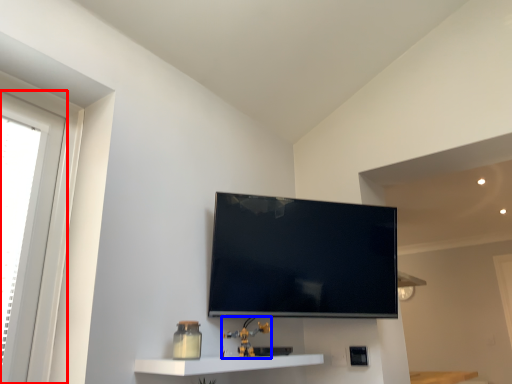
Question: Which of the following is the farthest to the observer, window (highlighted by a red box) or toy (highlighted by a blue box)?

Choices:
 (A) window
 (B) toy

Answer: (B)